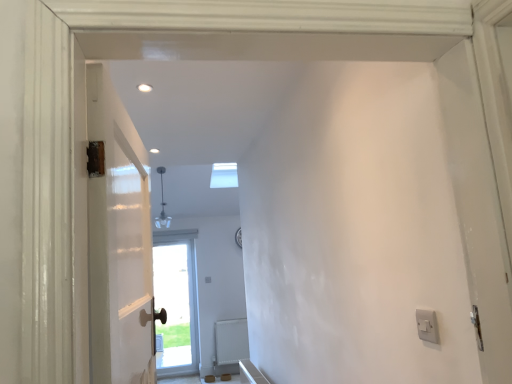
Question: From the image's perspective, would you say matte brown door at center, placed as the 1th door when sorted from back to front, is positioned over white matte radiator at lower center?

Choices:
 (A) yes
 (B) no

Answer: (A)

Question: Is matte brown door at center, which is the second door in front-to-back order, wider than white matte radiator at lower center?

Choices:
 (A) no
 (B) yes

Answer: (B)

Question: Is matte brown door at center, acting as the 2th door starting from the right, not close to white matte radiator at lower center?

Choices:
 (A) no
 (B) yes

Answer: (A)

Question: Considering the relative sizes of matte brown door at center, acting as the 2th door starting from the right, and white matte radiator at lower center in the image provided, is matte brown door at center, acting as the 2th door starting from the right, thinner than white matte radiator at lower center?

Choices:
 (A) no
 (B) yes

Answer: (A)

Question: Does matte brown door at center, which is the second door in front-to-back order, have a smaller size compared to white matte radiator at lower center?

Choices:
 (A) no
 (B) yes

Answer: (A)

Question: Based on their positions, is white painted wood door at left, which appears as the 1th door when viewed from the front, located to the left or right of white plastic switch at right?

Choices:
 (A) right
 (B) left

Answer: (B)

Question: From their relative heights in the image, would you say white painted wood door at left, which is the 1th door from top to bottom, is taller or shorter than white plastic switch at right?

Choices:
 (A) tall
 (B) short

Answer: (A)

Question: From a real-world perspective, relative to white plastic switch at right, is white painted wood door at left, the second door positioned from the back, vertically above or below?

Choices:
 (A) above
 (B) below

Answer: (A)

Question: Is point (119, 238) positioned closer to the camera than point (437, 332)?

Choices:
 (A) closer
 (B) farther

Answer: (B)

Question: From the image's perspective, relative to white matte radiator at lower center, is white plastic switch at right above or below?

Choices:
 (A) below
 (B) above

Answer: (B)

Question: Considering their positions, is white plastic switch at right located in front of or behind white matte radiator at lower center?

Choices:
 (A) behind
 (B) front

Answer: (B)

Question: Does point (423, 317) appear closer or farther from the camera than point (219, 360)?

Choices:
 (A) farther
 (B) closer

Answer: (B)

Question: Considering the positions of white plastic switch at right and white matte radiator at lower center in the image, is white plastic switch at right bigger or smaller than white matte radiator at lower center?

Choices:
 (A) big
 (B) small

Answer: (B)

Question: Based on their sizes in the image, would you say matte brown door at center, acting as the 2th door starting from the right, is bigger or smaller than white plastic switch at right?

Choices:
 (A) big
 (B) small

Answer: (A)

Question: From a real-world perspective, is matte brown door at center, the 2th door viewed from the top, physically located above or below white plastic switch at right?

Choices:
 (A) above
 (B) below

Answer: (B)